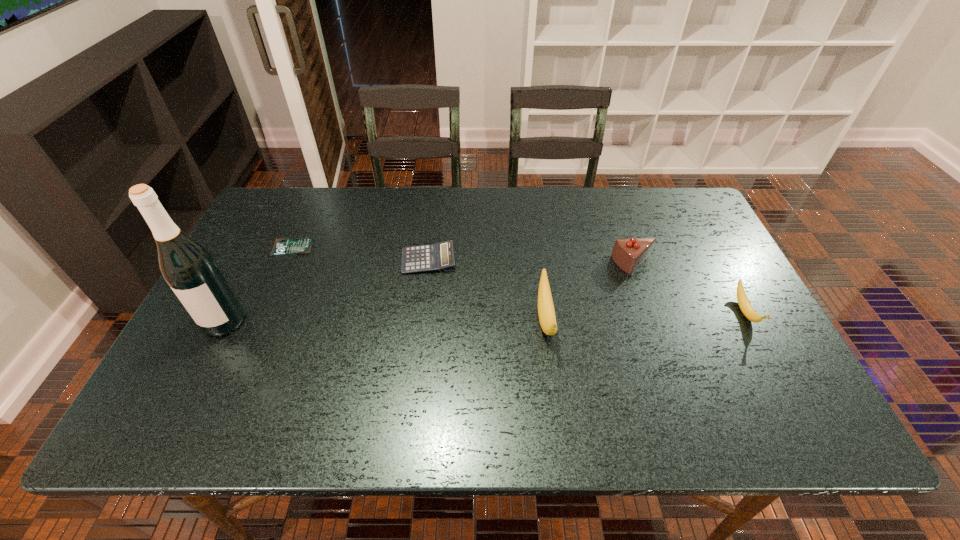
At what (x,y) coordinates should I click in order to perform the action: click on the taller banana. Please return your answer as a coordinate pair (x, y). Looking at the image, I should click on (546, 312).

In order to click on the second tallest object in this screenshot , I will do `click(546, 312)`.

I want to click on the shorter banana, so click(x=743, y=302).

The height and width of the screenshot is (540, 960). I want to click on the right banana, so click(x=743, y=302).

Locate an element on the screen. The width and height of the screenshot is (960, 540). the fifth tallest object is located at coordinates (439, 256).

Where is `calculator`? calculator is located at coordinates (439, 256).

This screenshot has width=960, height=540. In order to click on the shortest object in this screenshot , I will do `click(281, 246)`.

I want to click on chocolate cake, so click(628, 254).

This screenshot has height=540, width=960. I want to click on wine bottle, so click(x=190, y=270).

Identify the location of vacant space located 0.110m at the stem of the third shortest object. The image size is (960, 540). (779, 376).